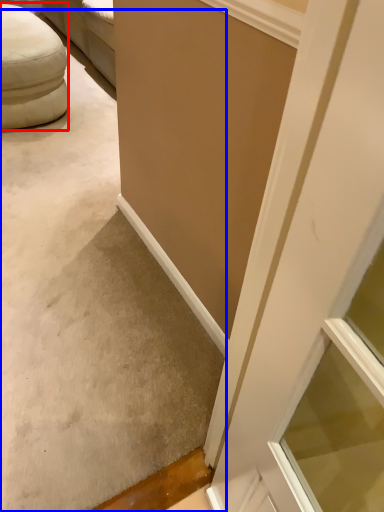
Question: Which point is closer to the camera, furniture (highlighted by a red box) or concrete (highlighted by a blue box)?

Choices:
 (A) furniture
 (B) concrete

Answer: (B)